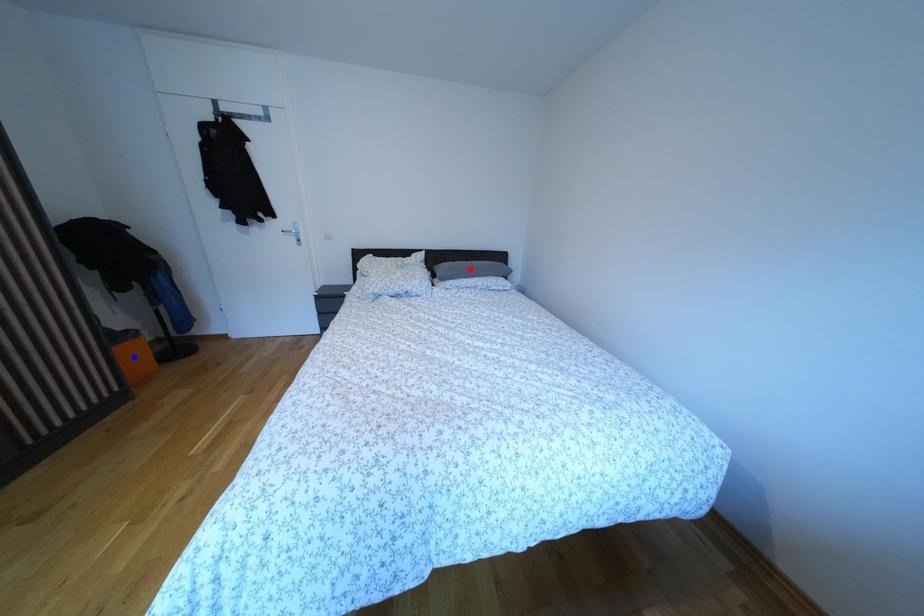
Question: Two points are marked on the image. Which point is closer to the camera?

Choices:
 (A) Blue point is closer.
 (B) Red point is closer.

Answer: (A)